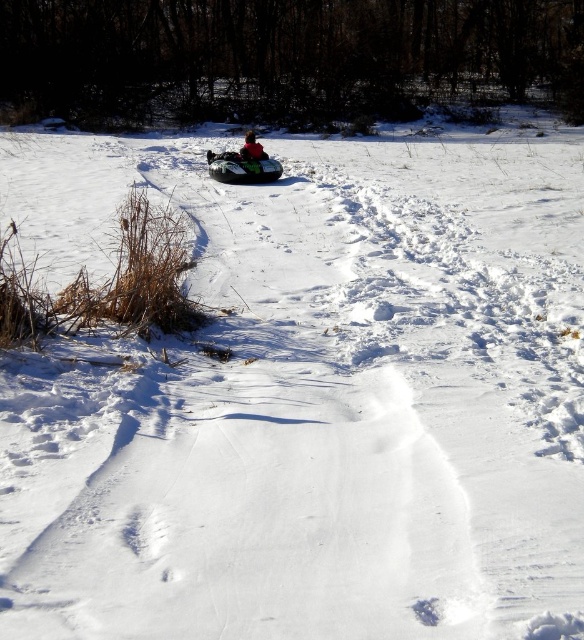
Question: Can you confirm if green plastic snowmobile at center is wider than red matte jacket at center?

Choices:
 (A) yes
 (B) no

Answer: (A)

Question: Does green plastic snowmobile at center lie behind red matte jacket at center?

Choices:
 (A) no
 (B) yes

Answer: (A)

Question: Is green plastic snowmobile at center wider than red matte jacket at center?

Choices:
 (A) yes
 (B) no

Answer: (A)